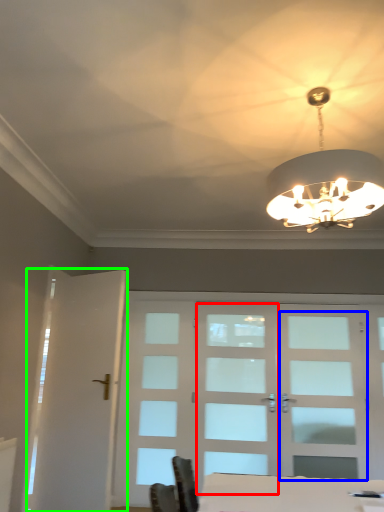
Question: Which object is the closest to the screen door (highlighted by a red box)? Choose among these: screen door (highlighted by a blue box) or screen door (highlighted by a green box).

Choices:
 (A) screen door
 (B) screen door

Answer: (A)